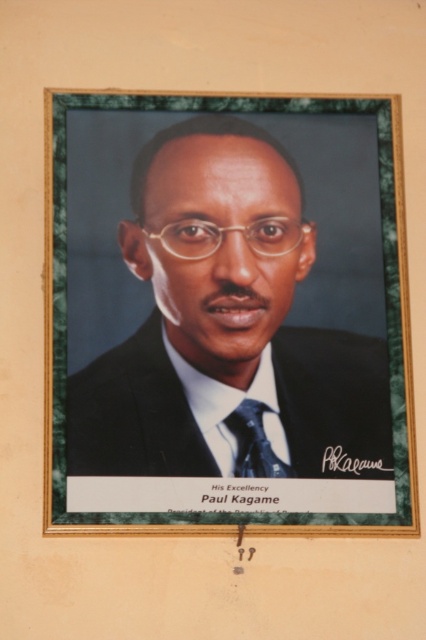
Question: Is black satin business suit at center positioned at the back of black silk tie at center?

Choices:
 (A) yes
 (B) no

Answer: (A)

Question: Does wooden picture frame at center appear on the left side of black silk tie at center?

Choices:
 (A) yes
 (B) no

Answer: (A)

Question: Estimate the real-world distances between objects in this image. Which object is farther from the wooden picture frame at center?

Choices:
 (A) black satin business suit at center
 (B) black silk tie at center

Answer: (A)

Question: Estimate the real-world distances between objects in this image. Which object is closer to the black silk tie at center?

Choices:
 (A) black satin business suit at center
 (B) wooden picture frame at center

Answer: (A)

Question: Which object appears farthest from the camera in this image?

Choices:
 (A) black satin business suit at center
 (B) black silk tie at center

Answer: (A)

Question: Is wooden picture frame at center positioned in front of black silk tie at center?

Choices:
 (A) yes
 (B) no

Answer: (A)